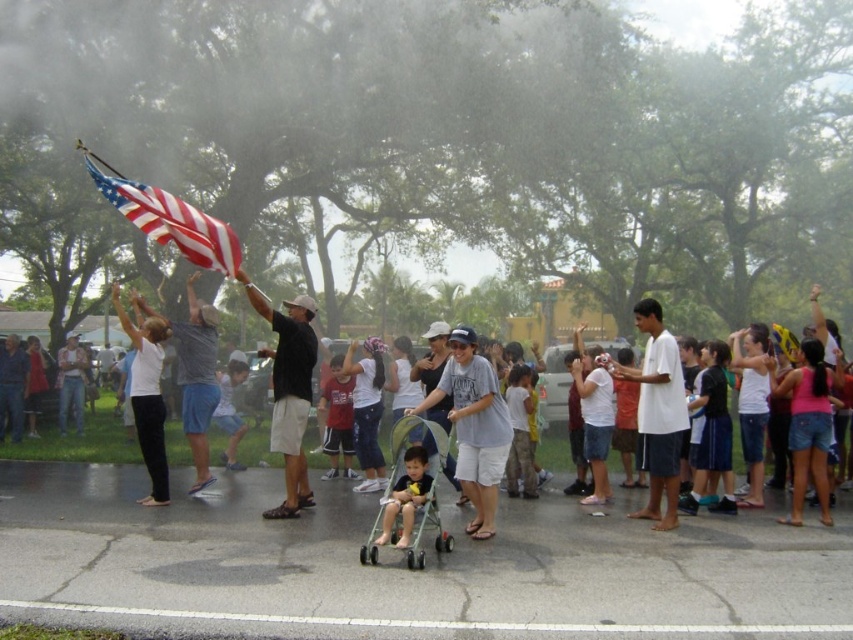
You are a photographer standing at the edge of the crowd. You want to take a photo that includes both the matte red shirt at center and the denim shorts at center. Given that your camera has a maximum focus range of 6 meters, will you be able to capture both subjects in focus without moving closer?

The matte red shirt at center is 6.90 meters from denim shorts at center. Since the distance between them exceeds the camera maximum focus range of 6 meters, you won not be able to capture both subjects in focus without moving closer.

You are a photographer at the parade and want to capture both the white cotton shirt at right and the black cotton shirt at center in a single photo. Which shirt should you position closer to the center of the frame to ensure both are visible?

You should position the black cotton shirt at center closer to the center of the frame since it is already at the center, making it easier to include the white cotton shirt at right which is to the right of it in the image.